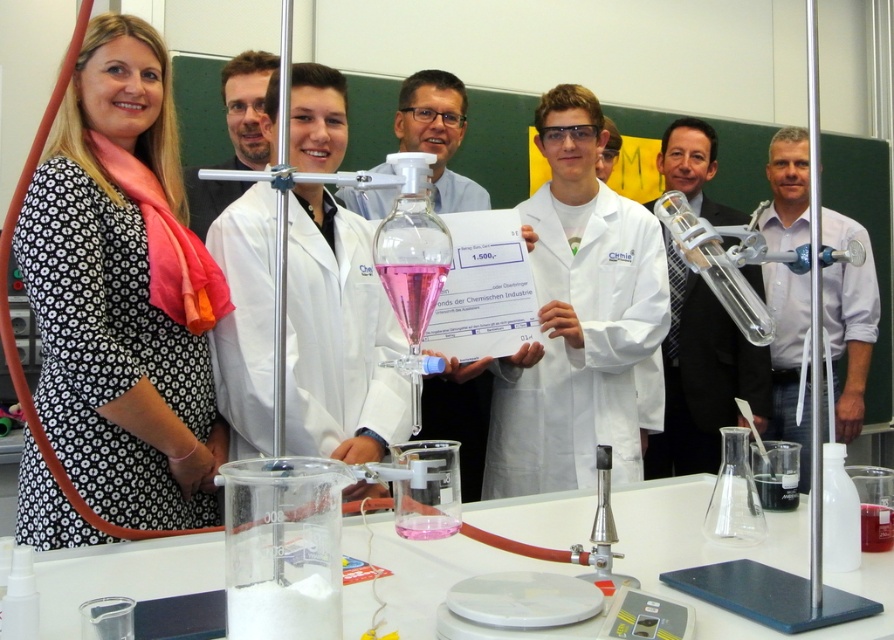
Question: Does white lab coat at center have a larger size compared to white shirt at center?

Choices:
 (A) yes
 (B) no

Answer: (B)

Question: Which object is farther from the camera taking this photo?

Choices:
 (A) white lab coat at center
 (B) black floral dress at left
 (C) matte black lab coat at center
 (D) white shirt at center

Answer: (D)

Question: Does clear glass tube at center come behind matte black lab coat at center?

Choices:
 (A) no
 (B) yes

Answer: (B)

Question: Is white lab coat at center smaller than clear glass tube at center?

Choices:
 (A) yes
 (B) no

Answer: (A)

Question: Estimate the real-world distances between objects in this image. Which object is closer to the matte black lab coat at center?

Choices:
 (A) white shirt at center
 (B) black floral dress at left
 (C) white lab coat at center

Answer: (B)

Question: Among these objects, which one is farthest from the camera?

Choices:
 (A) matte black lab coat at center
 (B) black floral dress at left
 (C) white shirt at center

Answer: (C)